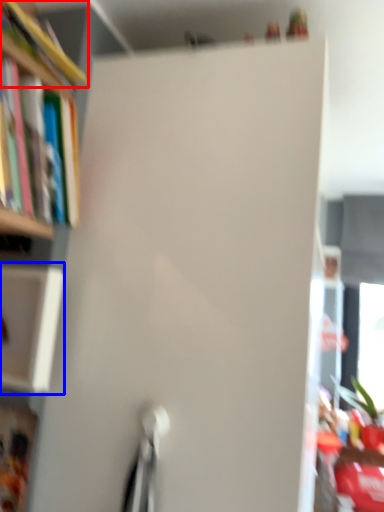
Question: Which of the following is the closest to the observer, book (highlighted by a red box) or cabinet (highlighted by a blue box)?

Choices:
 (A) book
 (B) cabinet

Answer: (A)